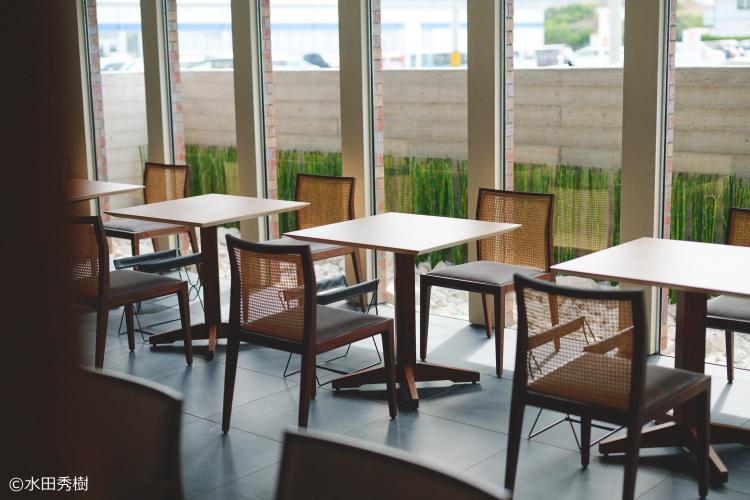
Identify the location of tables. This screenshot has width=750, height=500. (97, 190), (201, 205), (396, 231), (657, 269).